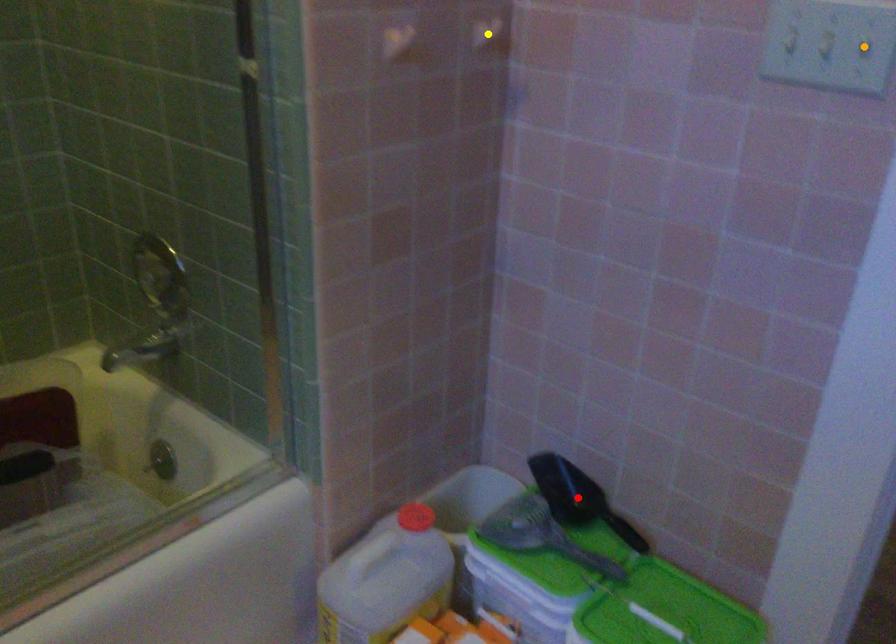
Order these from nearest to farthest:
A) yellow point
B) red point
C) orange point

orange point < yellow point < red point